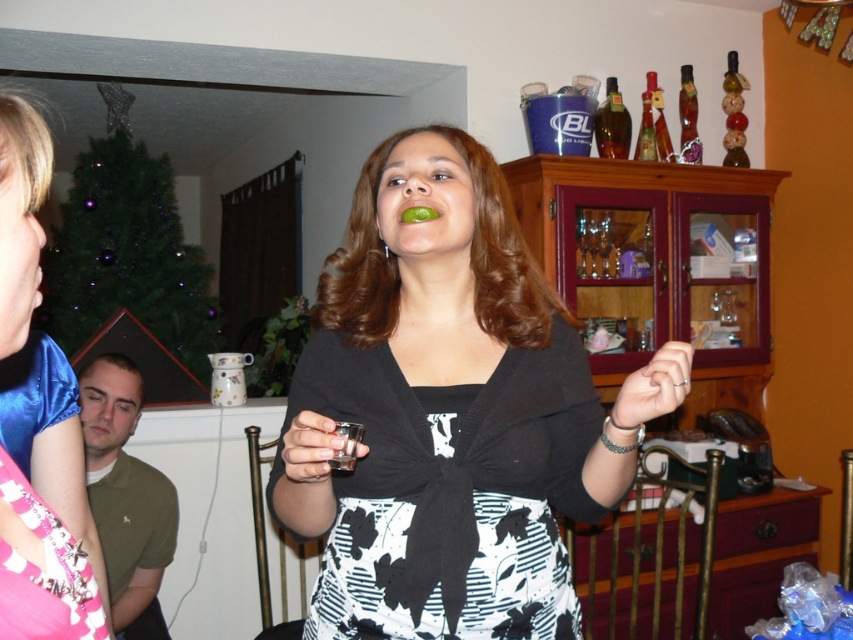
Question: Does matte black dress at center have a greater width compared to translucent glass bottle at upper right?

Choices:
 (A) no
 (B) yes

Answer: (B)

Question: Considering the relative positions of matte black dress at center and translucent amber glass bottle at upper right in the image provided, where is matte black dress at center located with respect to translucent amber glass bottle at upper right?

Choices:
 (A) left
 (B) right

Answer: (A)

Question: Among these points, which one is nearest to the camera?

Choices:
 (A) (86, 588)
 (B) (109, 419)

Answer: (A)

Question: Among these objects, which one is nearest to the camera?

Choices:
 (A) matte black dress at center
 (B) matte white cup at lower left

Answer: (A)

Question: Is matte black dress at center above green matte lime at center?

Choices:
 (A) yes
 (B) no

Answer: (B)

Question: Which point is farther to the camera?

Choices:
 (A) (105, 442)
 (B) (318, 609)

Answer: (A)